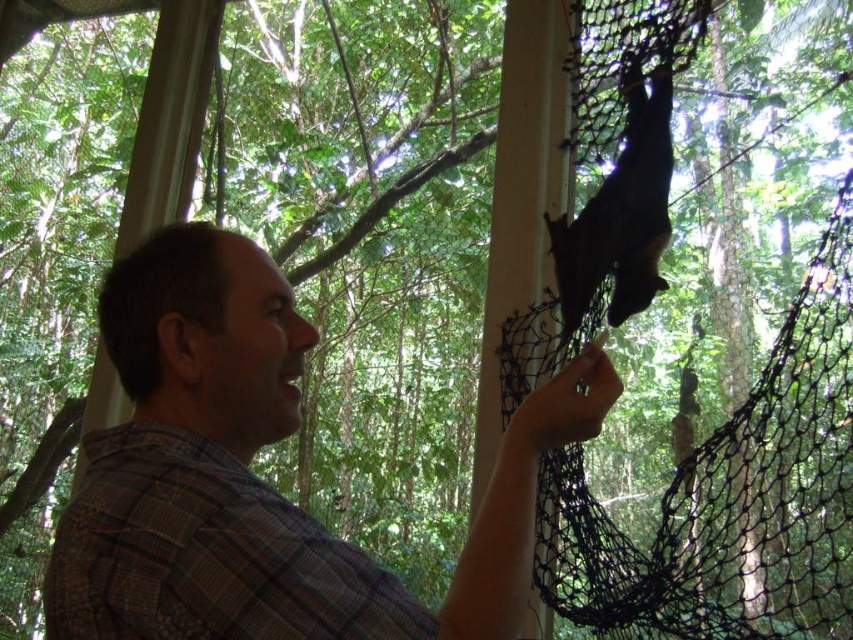
You are standing outside the forest cabin and see the plaid shirt at center and the black fur bat at upper center. Which object is nearer to you?

The plaid shirt at center is closer to the viewer than the black fur bat at upper center.

You are a wildlife researcher observing the scene. You need to determine the relative sizes of the plaid shirt at center and the black fur bat at upper center. Which object is taller?

The plaid shirt at center is taller than the black fur bat at upper center according to the description.